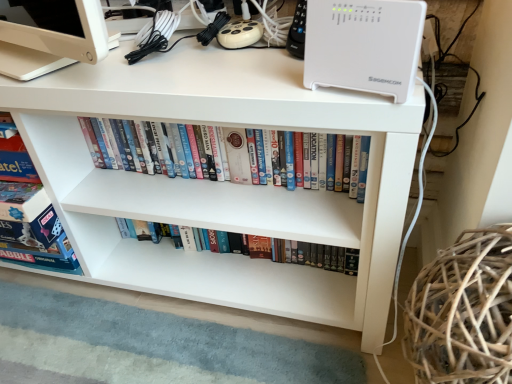
Question: Is point (77, 67) closer or farther from the camera than point (306, 256)?

Choices:
 (A) closer
 (B) farther

Answer: (A)

Question: Relative to white glossy bookshelf at center, the 1th book ordered from the bottom, is white matte desk at upper center in front or behind?

Choices:
 (A) behind
 (B) front

Answer: (B)

Question: Based on their relative distances, which object is farther from the white plastic dvds at center, the second book from the bottom?

Choices:
 (A) white matte desk at upper center
 (B) white glossy bookshelf at center, the 1th book ordered from the bottom
 (C) brown woven basket at lower right

Answer: (C)

Question: Which object is positioned closest to the white plastic dvds at center, the second book from the bottom?

Choices:
 (A) brown woven basket at lower right
 (B) white matte desk at upper center
 (C) white glossy bookshelf at center, the 1th book ordered from the bottom

Answer: (B)